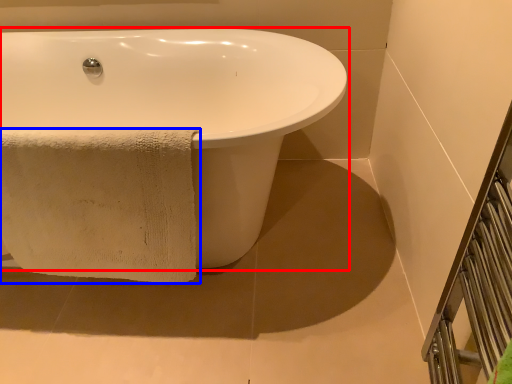
Question: Which point is closer to the camera, bathtub (highlighted by a red box) or towel (highlighted by a blue box)?

Choices:
 (A) bathtub
 (B) towel

Answer: (A)